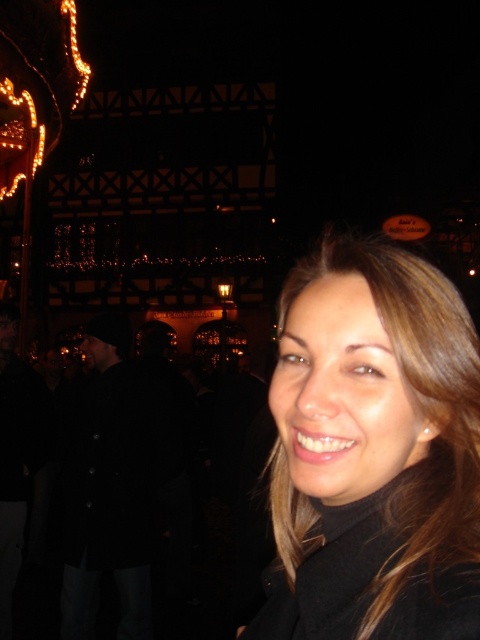
You are a fashion stylist trying to decide between two coats for a client attending a winter festival. The client prefers a coat that is shorter in length. Based on the image provided, which coat between the black matte coat at center and the black wool coat at left should you recommend?

The black matte coat at center is shorter than the black wool coat at left, so you should recommend the black matte coat at center for the client who prefers a shorter length.

You are a photographer setting up a tripod in the center of the scene. You need to position it so that it doesn not block the view of either the black matte coat at center or the black wool coat at left. Given their widths, which coat requires more space to the left of the tripod?

The black matte coat at center might be wider than black wool coat at left, so it requires more space to the left of the tripod to avoid blocking the view.

You are a photographer standing in the background of the scene. You want to take a photo of the woman in the black matte coat at center. To ensure the coat is in focus, where should you aim your camera? Please provide the coordinates in the format of a point like this example format for the answer, e.g., point at point_x, point_y. The scene is displayed on a screen with coordinates ranging from 0 to 1 in both x and y axes.

The black matte coat at center is located at point (373,451). Therefore, you should aim your camera at point (373,451) to focus on the coat.